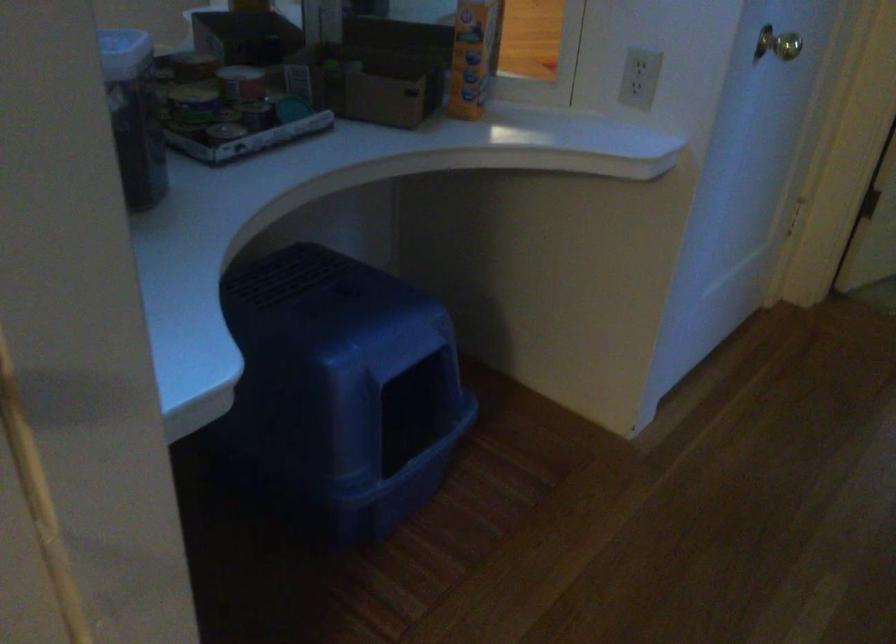
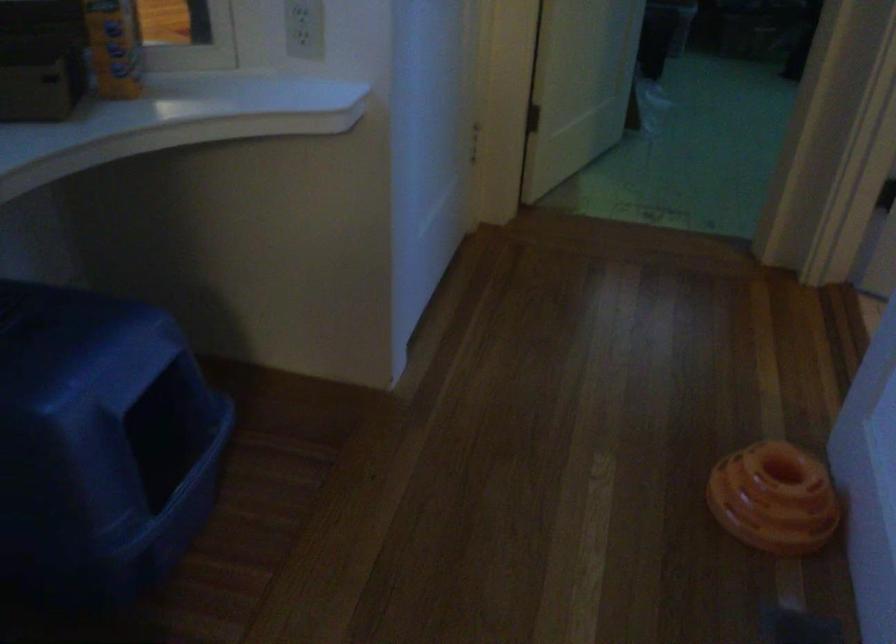
Locate, in the second image, the point that corresponds to (460,73) in the first image.

(114, 46)